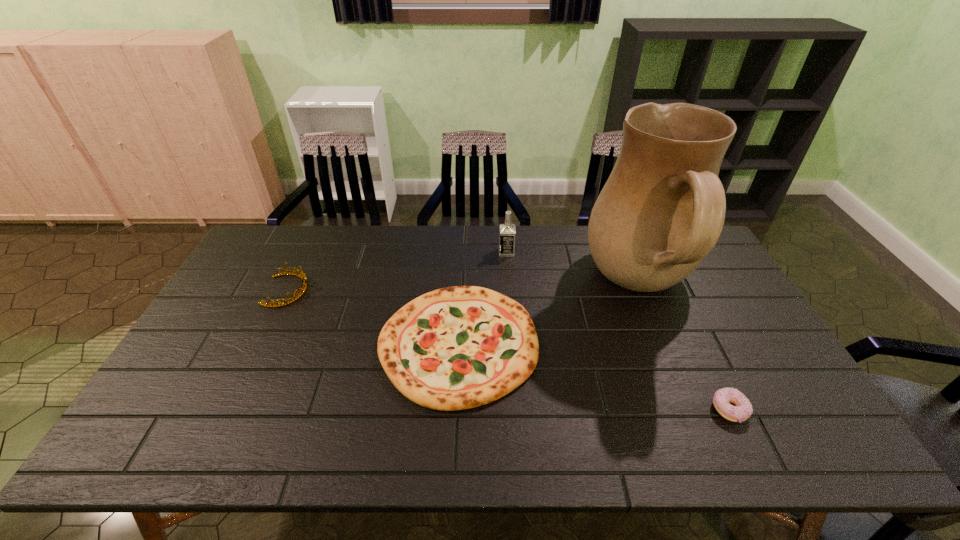
Find the location of `doughnut that is at the right edge`. doughnut that is at the right edge is located at coordinates (742, 409).

At what (x,y) coordinates should I click in order to perform the action: click on object at the far right corner. Please return your answer as a coordinate pair (x, y). The image size is (960, 540). Looking at the image, I should click on (662, 210).

Locate an element on the screen. object situated at the near right corner is located at coordinates (742, 409).

You are a GUI agent. You are given a task and a screenshot of the screen. Output one action in this format:
    pyautogui.click(x=<x>, y=<y>)
    Task: Click on the free space at the far edge of the desktop
    The image size is (960, 540).
    Given the screenshot: What is the action you would take?
    pyautogui.click(x=427, y=264)

Identify the location of free space at the near edge of the desktop. The height and width of the screenshot is (540, 960). (230, 427).

What are the coordinates of `vacant space at the left edge of the desktop` in the screenshot? It's located at (253, 295).

Where is `vacant space at the right edge of the desktop`? This screenshot has height=540, width=960. vacant space at the right edge of the desktop is located at coordinates (751, 363).

I want to click on vacant region between the vodka and the tiara, so click(396, 271).

Find the location of a particular element. This screenshot has width=960, height=540. vacant area between the pizza and the cream pitcher is located at coordinates (549, 315).

At what (x,y) coordinates should I click in order to perform the action: click on vacant region between the vodka and the tallest object. Please return your answer as a coordinate pair (x, y). Image resolution: width=960 pixels, height=540 pixels. Looking at the image, I should click on [x=573, y=269].